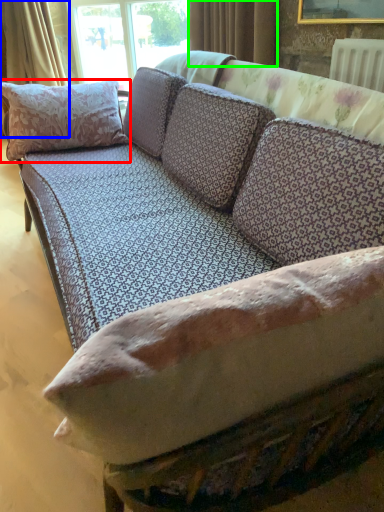
Question: Based on their relative distances, which object is nearer to pillow (highlighted by a red box)? Choose from curtain (highlighted by a blue box) and curtain (highlighted by a green box).

Choices:
 (A) curtain
 (B) curtain

Answer: (B)